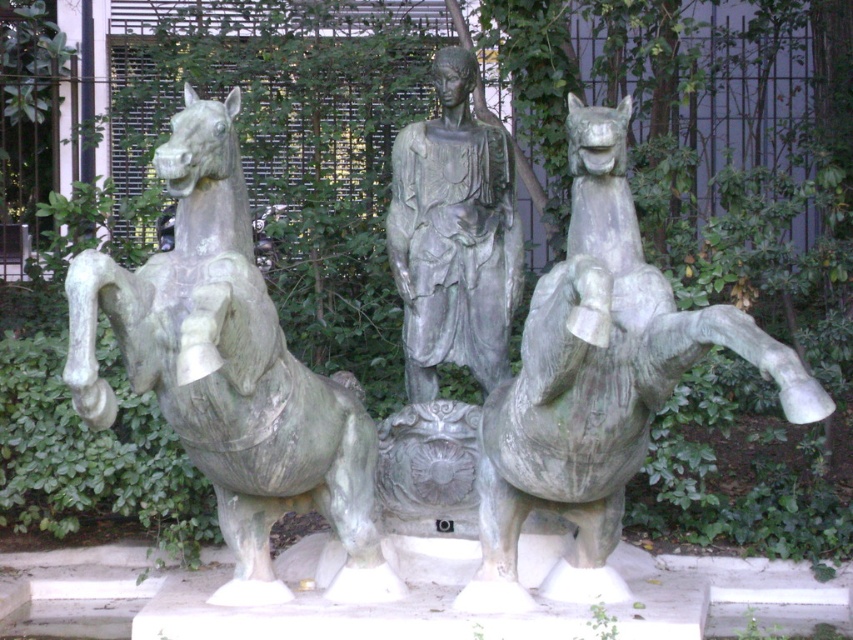
You are an art conservator examining the bronze sculpture. You notice that the green patina horse at left and the green patina horse at center have different sizes. Which horse is bigger?

The green patina horse at left is larger in size than the green patina horse at center.

Based on the coordinates provided, which object is located at point (230,371) in the image?

The point (230,371) marks the location of the green patina horse at left.

You are a sculptor who needs to place a small plaque between the two green patina horses. The plaque is 0.5 meters wide. Is there enough space between the green patina horse at left and the green patina horse at center to fit the plaque?

The green patina horse at left is 1.31 meters from the green patina horse at center. Since the plaque is only 0.5 meters wide, there is sufficient space between them to place the plaque.